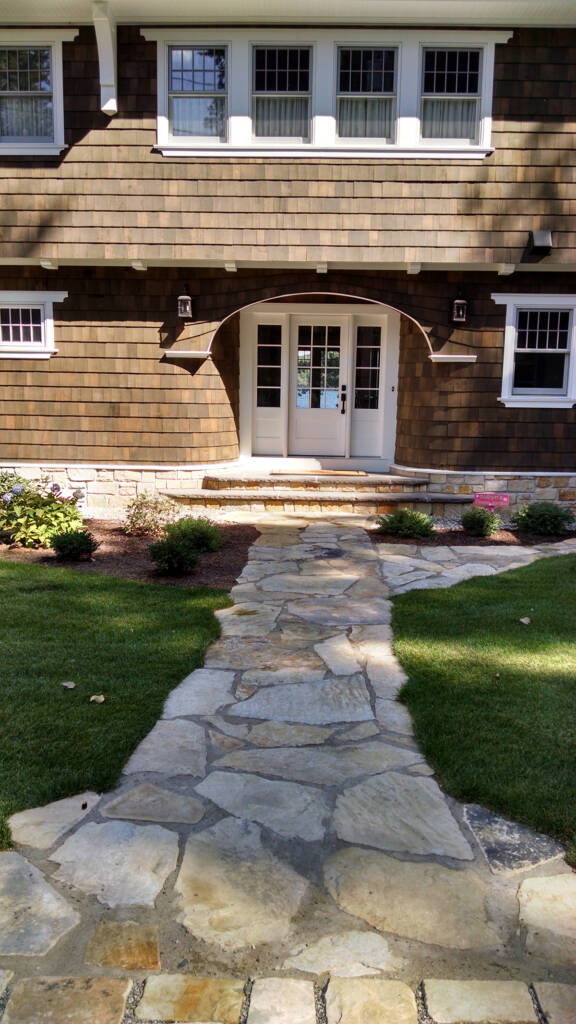
The height and width of the screenshot is (1024, 576). Identify the location of walk way. (278, 680).